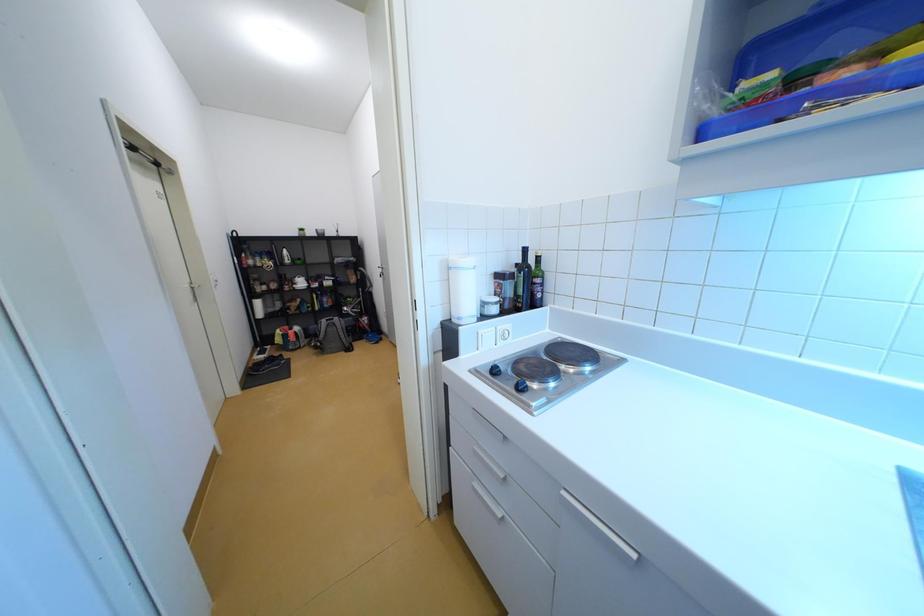
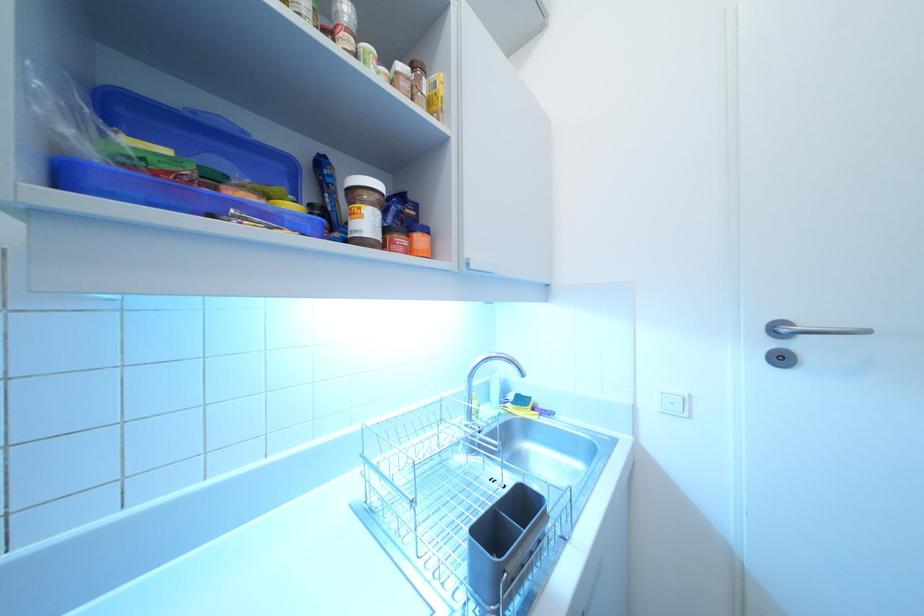
Question: The camera is either moving clockwise (left) or counter-clockwise (right) around the object. The first image is from the beginning of the video and the second image is from the end. Is the camera moving left or right when shooting the video?

Choices:
 (A) Left
 (B) Right

Answer: (A)